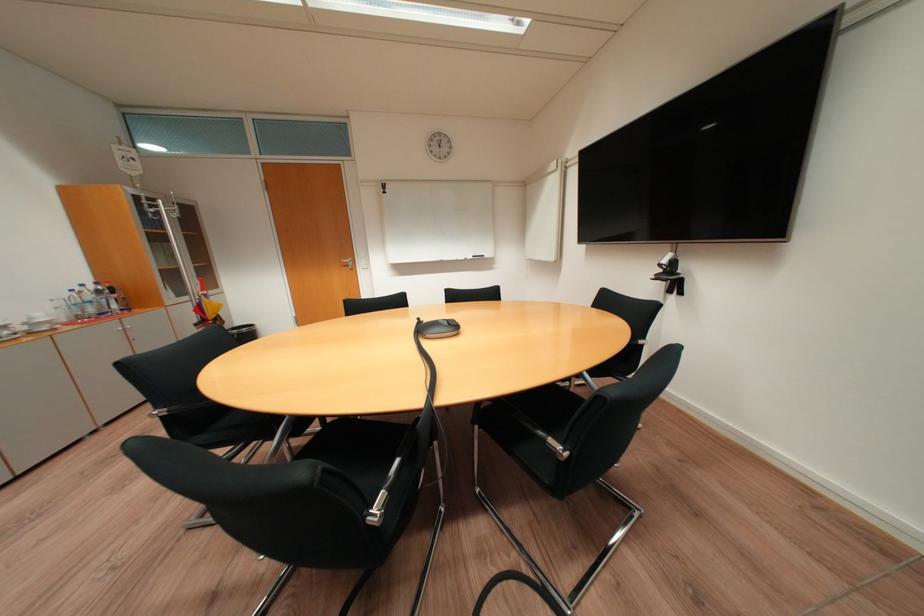
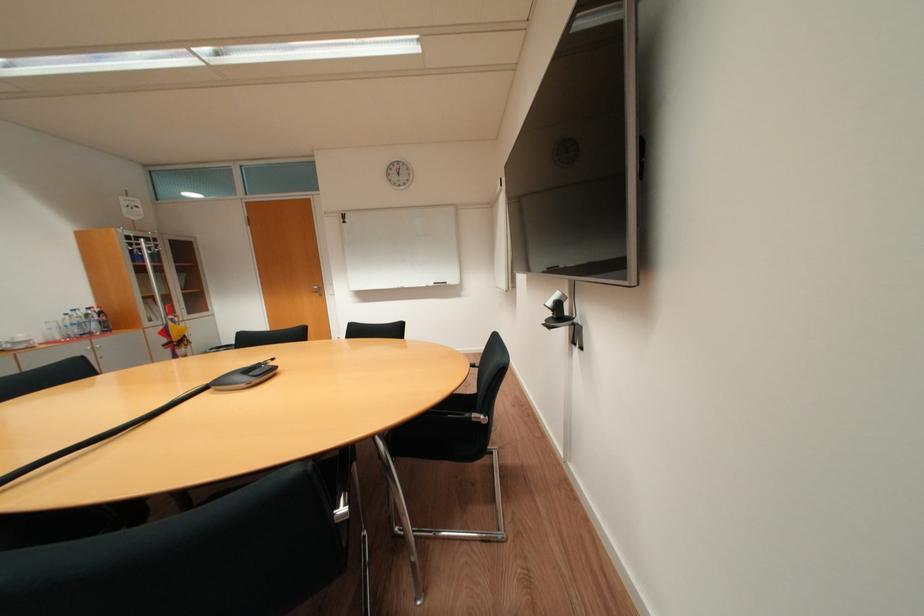
Question: Which direction would the cameraman need to move to produce the second image? Reply with the corresponding letter.

Choices:
 (A) Left
 (B) Right
 (C) Forward
 (D) Backward

Answer: (B)